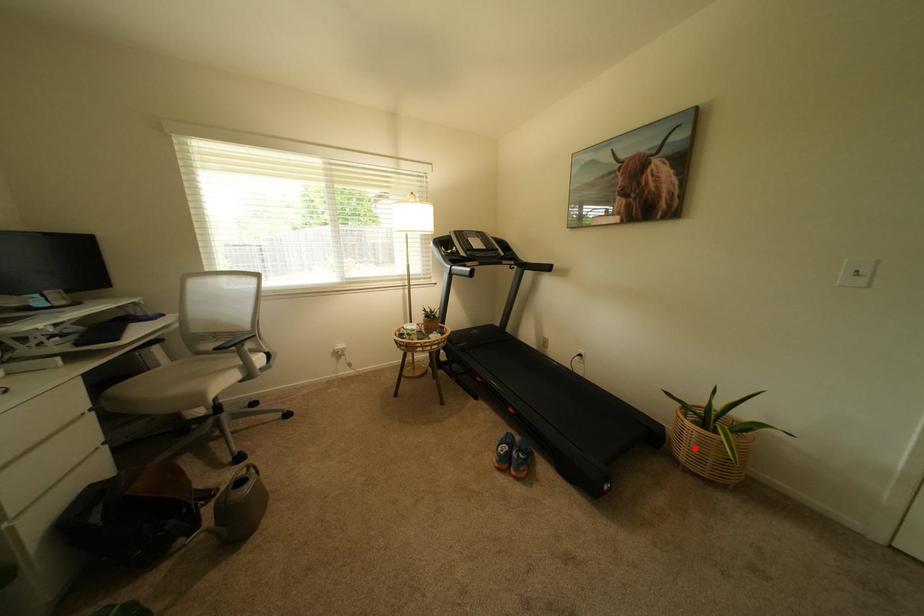
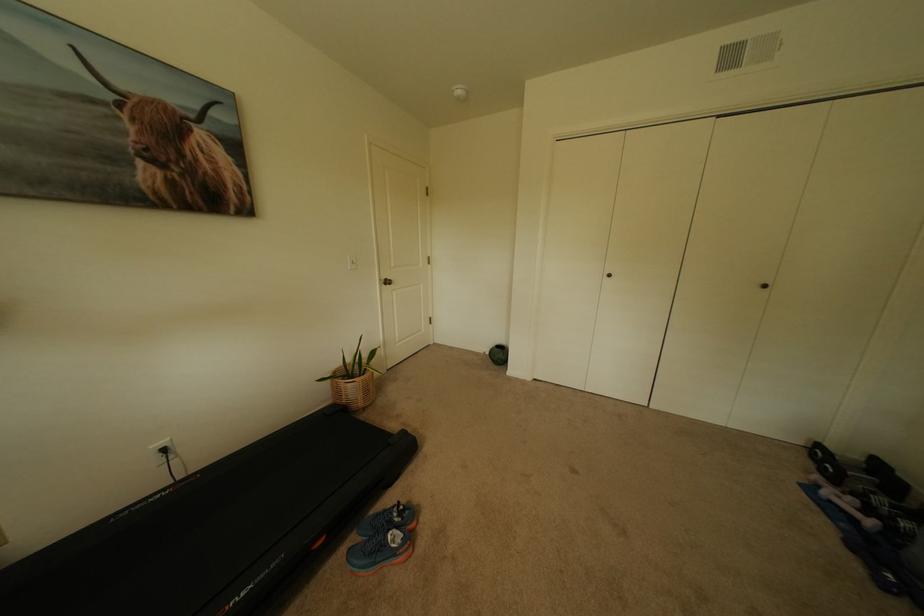
Question: A red point is marked in image1. In image2, is the corresponding 3D point closer to the camera or farther? Reply with the corresponding letter.

Choices:
 (A) The corresponding 3D point is closer.
 (B) The corresponding 3D point is farther.

Answer: (A)